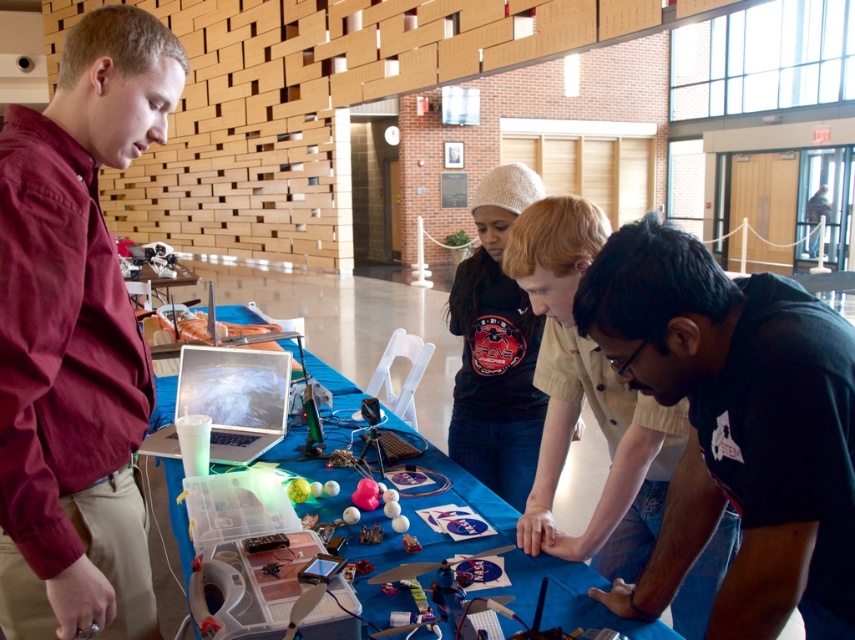
Question: Does matte black shirt at center have a smaller size compared to dark blue sweater at center?

Choices:
 (A) yes
 (B) no

Answer: (A)

Question: Does maroon shirt at left have a larger size compared to matte black shirt at center?

Choices:
 (A) yes
 (B) no

Answer: (B)

Question: Which of the following is the farthest from the observer?

Choices:
 (A) dark blue sweater at center
 (B) matte black shirt at center
 (C) shiny silver laptop at center

Answer: (C)

Question: Among these points, which one is farthest from the camera?

Choices:
 (A) (x=494, y=275)
 (B) (x=204, y=372)
 (C) (x=95, y=40)
 (D) (x=233, y=314)

Answer: (D)

Question: Can you confirm if maroon shirt at left is positioned to the left of matte black shirt at center?

Choices:
 (A) no
 (B) yes

Answer: (B)

Question: Which point is farther to the camera?

Choices:
 (A) maroon shirt at left
 (B) blue fabric table at center

Answer: (B)